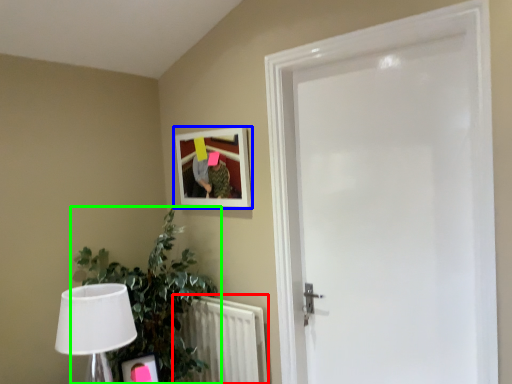
Question: Based on their relative distances, which object is farther from radiator (highlighted by a red box)? Choose from picture frame (highlighted by a blue box) and houseplant (highlighted by a green box).

Choices:
 (A) picture frame
 (B) houseplant

Answer: (A)